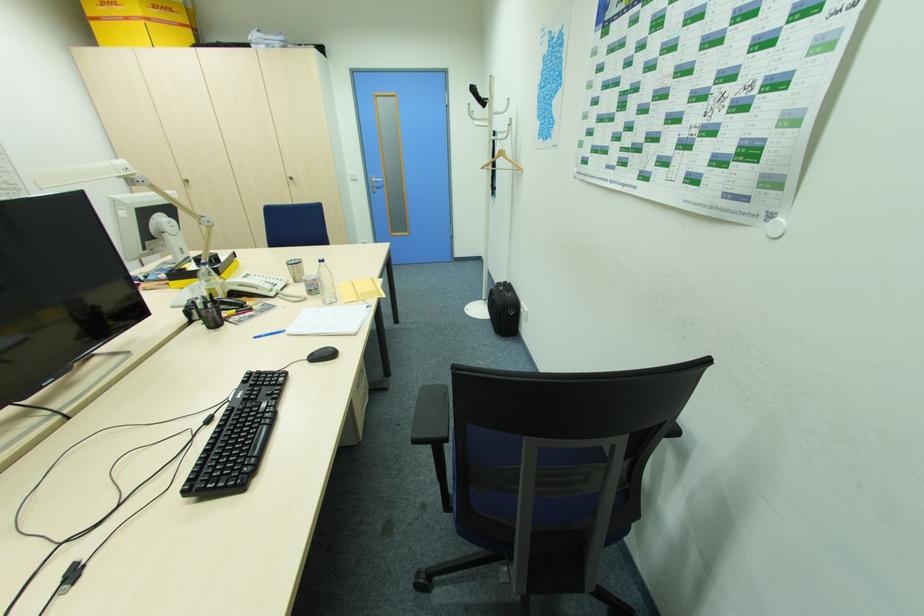
Image resolution: width=924 pixels, height=616 pixels. I want to click on white coat rack hook, so click(505, 108).